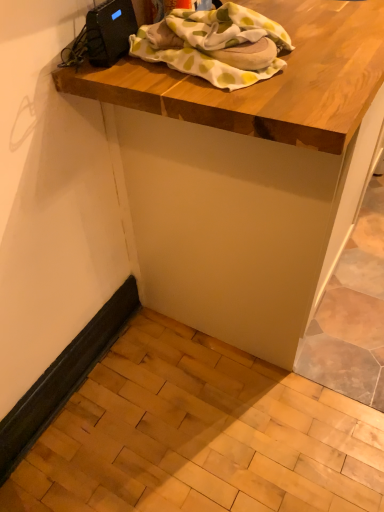
This screenshot has height=512, width=384. What do you see at coordinates (215, 45) in the screenshot?
I see `white cotton blanket at upper center` at bounding box center [215, 45].

The image size is (384, 512). Find the location of `white cotton blanket at upper center`. white cotton blanket at upper center is located at coordinates (215, 45).

Image resolution: width=384 pixels, height=512 pixels. What do you see at coordinates (246, 174) in the screenshot? I see `wooden table at upper center` at bounding box center [246, 174].

I want to click on wooden table at upper center, so click(246, 174).

Measure the distance between point [347,86] and camera.

The depth of point [347,86] is 31.54 inches.

The height and width of the screenshot is (512, 384). Find the location of `white cotton blanket at upper center`. white cotton blanket at upper center is located at coordinates tap(215, 45).

In the scene shown: Between wooden table at upper center and white cotton blanket at upper center, which one appears on the left side from the viewer's perspective?

Positioned to the left is white cotton blanket at upper center.

Is wooden table at upper center closer to camera compared to white cotton blanket at upper center?

Yes, wooden table at upper center is closer to the camera.

Is point (248, 111) positioned before point (261, 17)?

That is True.

From the image's perspective, is wooden table at upper center under white cotton blanket at upper center?

Incorrect, from the image's perspective, wooden table at upper center is higher than white cotton blanket at upper center.

From a real-world perspective, who is located lower, wooden table at upper center or white cotton blanket at upper center?

wooden table at upper center is physically lower.

Can you confirm if wooden table at upper center is wider than white cotton blanket at upper center?

Correct, the width of wooden table at upper center exceeds that of white cotton blanket at upper center.

Between wooden table at upper center and white cotton blanket at upper center, which one has less height?

white cotton blanket at upper center is shorter.

Which of these two, wooden table at upper center or white cotton blanket at upper center, is bigger?

With larger size is wooden table at upper center.

Is wooden table at upper center not within white cotton blanket at upper center?

Absolutely, wooden table at upper center is external to white cotton blanket at upper center.

Is wooden table at upper center next to white cotton blanket at upper center and touching it?

They are not placed beside each other.

Could you tell me if wooden table at upper center is turned towards white cotton blanket at upper center?

No.

How different are the orientations of wooden table at upper center and white cotton blanket at upper center in degrees?

There is a 0.74-degree angle between the facing directions of wooden table at upper center and white cotton blanket at upper center.

How far apart are wooden table at upper center and white cotton blanket at upper center?

11.47 inches.

The image size is (384, 512). What are the coordinates of `table that appears below the white cotton blanket at upper center (from a real-world perspective)` in the screenshot? It's located at (246, 174).

Is white cotton blanket at upper center to the left of wooden table at upper center from the viewer's perspective?

Yes, white cotton blanket at upper center is to the left of wooden table at upper center.

Is white cotton blanket at upper center in front of or behind wooden table at upper center in the image?

Clearly, white cotton blanket at upper center is behind wooden table at upper center.

Between point (156, 56) and point (105, 131), which one is positioned behind?

The point (105, 131) is behind.

From the image's perspective, is white cotton blanket at upper center above or below wooden table at upper center?

Clearly, from the image's perspective, white cotton blanket at upper center is below wooden table at upper center.

From a real-world perspective, is white cotton blanket at upper center positioned above or below wooden table at upper center?

From a real-world perspective, white cotton blanket at upper center is physically above wooden table at upper center.

Looking at this image, considering the sizes of objects white cotton blanket at upper center and wooden table at upper center in the image provided, who is thinner, white cotton blanket at upper center or wooden table at upper center?

Thinner between the two is white cotton blanket at upper center.

Who is taller, white cotton blanket at upper center or wooden table at upper center?

wooden table at upper center.

Considering the relative sizes of white cotton blanket at upper center and wooden table at upper center in the image provided, is white cotton blanket at upper center bigger than wooden table at upper center?

Incorrect, white cotton blanket at upper center is not larger than wooden table at upper center.

Looking at this image, is white cotton blanket at upper center positioned beyond the bounds of wooden table at upper center?

Yes, white cotton blanket at upper center is located beyond the bounds of wooden table at upper center.

Are white cotton blanket at upper center and wooden table at upper center located far from each other?

No, white cotton blanket at upper center is not far away from wooden table at upper center.

Is white cotton blanket at upper center facing towards wooden table at upper center?

No, white cotton blanket at upper center is not facing towards wooden table at upper center.

How different are the orientations of white cotton blanket at upper center and wooden table at upper center in degrees?

There is a 0.74-degree angle between the facing directions of white cotton blanket at upper center and wooden table at upper center.

Looking at this image, how much distance is there between white cotton blanket at upper center and wooden table at upper center?

white cotton blanket at upper center and wooden table at upper center are 11.47 inches apart from each other.

Locate an element on the screen. blanket located behind the wooden table at upper center is located at coordinates (215, 45).

At what (x,y) coordinates should I click in order to perform the action: click on table on the right of white cotton blanket at upper center. Please return your answer as a coordinate pair (x, y). The image size is (384, 512). Looking at the image, I should click on (246, 174).

You are a GUI agent. You are given a task and a screenshot of the screen. Output one action in this format:
    pyautogui.click(x=<x>, y=<y>)
    Task: Click on the table above the white cotton blanket at upper center (from the image's perspective)
    Image resolution: width=384 pixels, height=512 pixels.
    Given the screenshot: What is the action you would take?
    pyautogui.click(x=246, y=174)